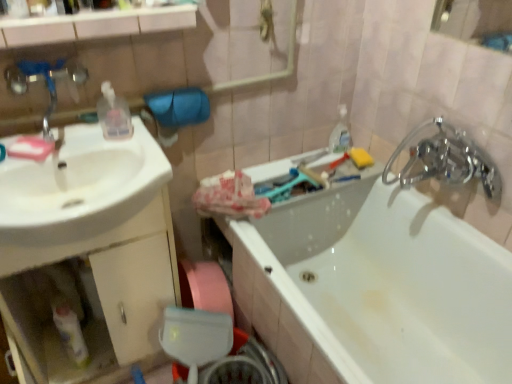
Question: Is chrome metallic faucet at upper right placed right next to transparent plastic bottle at upper left, the 2th bottle when ordered from left to right?

Choices:
 (A) yes
 (B) no

Answer: (B)

Question: From a real-world perspective, is chrome metallic faucet at upper right located beneath transparent plastic bottle at upper left, which ranks as the 2th bottle in bottom-to-top order?

Choices:
 (A) yes
 (B) no

Answer: (A)

Question: Is chrome metallic faucet at upper right positioned with its back to transparent plastic bottle at upper left, the first bottle positioned from the top?

Choices:
 (A) no
 (B) yes

Answer: (A)

Question: Considering the relative sizes of chrome metallic faucet at upper right and transparent plastic bottle at upper left, acting as the first bottle starting from the right, in the image provided, is chrome metallic faucet at upper right smaller than transparent plastic bottle at upper left, acting as the first bottle starting from the right,?

Choices:
 (A) yes
 (B) no

Answer: (B)

Question: Is chrome metallic faucet at upper right completely or partially outside of transparent plastic bottle at upper left, acting as the first bottle starting from the right?

Choices:
 (A) yes
 (B) no

Answer: (A)

Question: From a real-world perspective, is pink matte soap at left, the 2th soap when ordered from back to front, physically located above or below brushed metal faucet at upper left?

Choices:
 (A) above
 (B) below

Answer: (B)

Question: Is pink matte soap at left, which is counted as the 1th soap, starting from the front, in front of or behind brushed metal faucet at upper left in the image?

Choices:
 (A) front
 (B) behind

Answer: (B)

Question: From the image's perspective, relative to brushed metal faucet at upper left, is pink matte soap at left, the 2th soap when ordered from back to front, above or below?

Choices:
 (A) below
 (B) above

Answer: (A)

Question: Looking at their shapes, would you say pink matte soap at left, the 2th soap when ordered from back to front, is wider or thinner than brushed metal faucet at upper left?

Choices:
 (A) thin
 (B) wide

Answer: (A)

Question: In the image, is brushed metal faucet at upper left positioned in front of or behind yellow sponge at upper right, the 2th soap when ordered from left to right?

Choices:
 (A) behind
 (B) front

Answer: (B)

Question: From a real-world perspective, is brushed metal faucet at upper left above or below yellow sponge at upper right, the 2th soap when ordered from left to right?

Choices:
 (A) above
 (B) below

Answer: (A)

Question: Is brushed metal faucet at upper left wider or thinner than yellow sponge at upper right, which is counted as the 1th soap, starting from the right?

Choices:
 (A) wide
 (B) thin

Answer: (A)

Question: From the image's perspective, is brushed metal faucet at upper left located above or below yellow sponge at upper right, which is the 1th soap in back-to-front order?

Choices:
 (A) above
 (B) below

Answer: (A)

Question: Is yellow sponge at upper right, which is the 1th soap in back-to-front order, taller or shorter than brushed metal faucet at upper left?

Choices:
 (A) short
 (B) tall

Answer: (A)

Question: Does point (369, 157) appear closer or farther from the camera than point (68, 74)?

Choices:
 (A) closer
 (B) farther

Answer: (B)